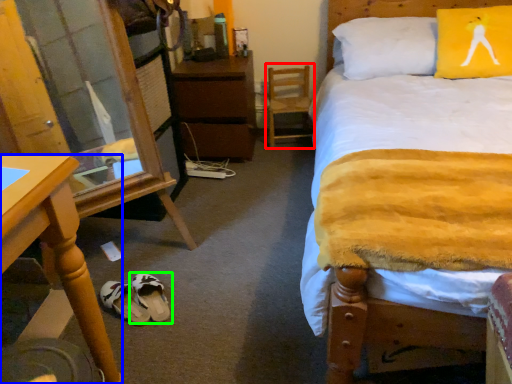
Question: Based on their relative distances, which object is nearer to swivel chair (highlighted by a red box)? Choose from desk (highlighted by a blue box) and footwear (highlighted by a green box).

Choices:
 (A) desk
 (B) footwear

Answer: (B)